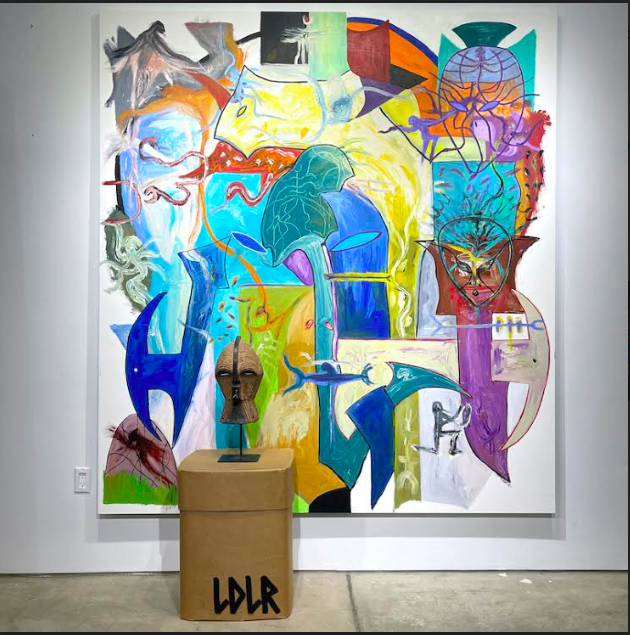
Find the location of a particular element. This screenshot has height=635, width=630. painting is located at coordinates (316, 297).